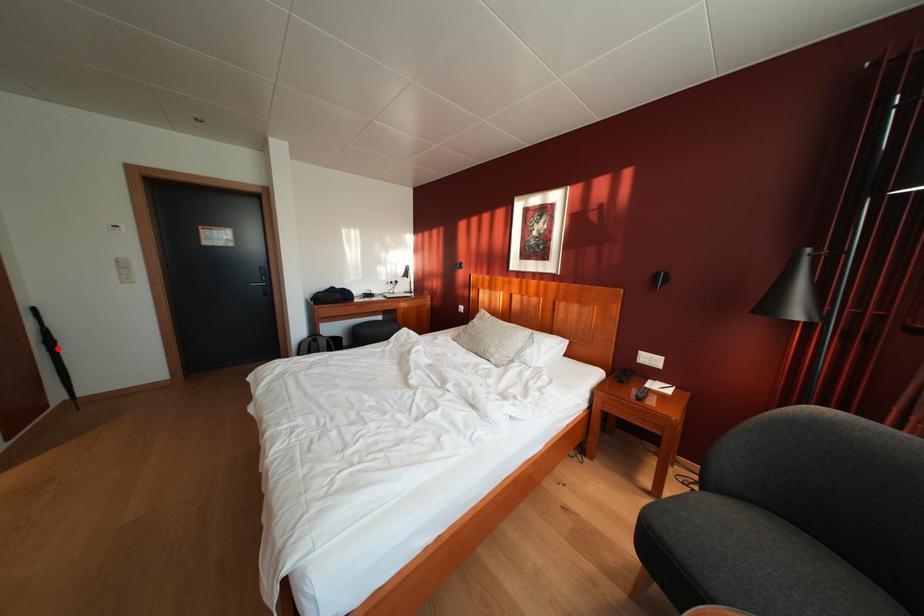
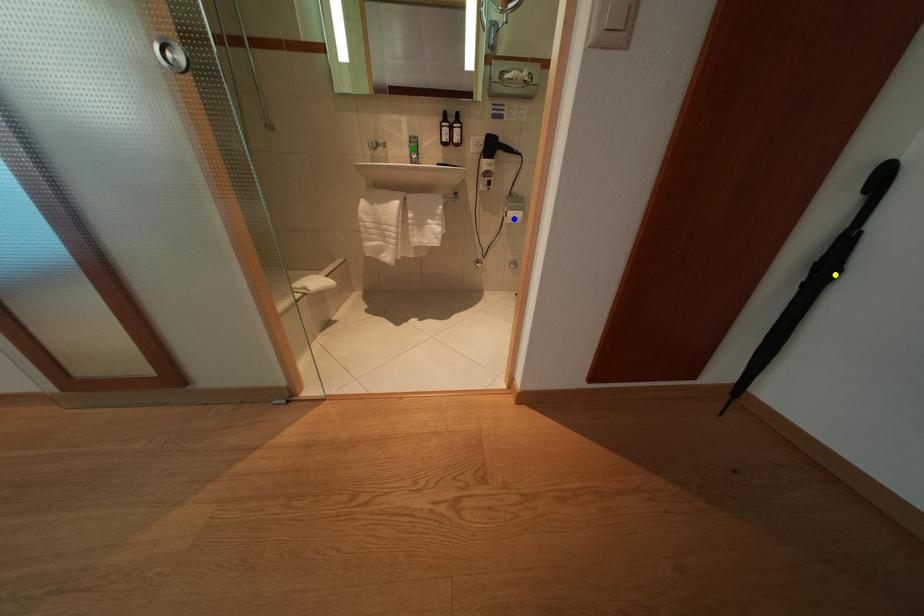
Question: I am providing you with two images of the same scene from different viewpoints. A red point is marked on the first image. You are given multiple points on the second image. Which spot in image 2 lines up with the point in image 1?

Choices:
 (A) yellow point
 (B) green point
 (C) blue point

Answer: (A)